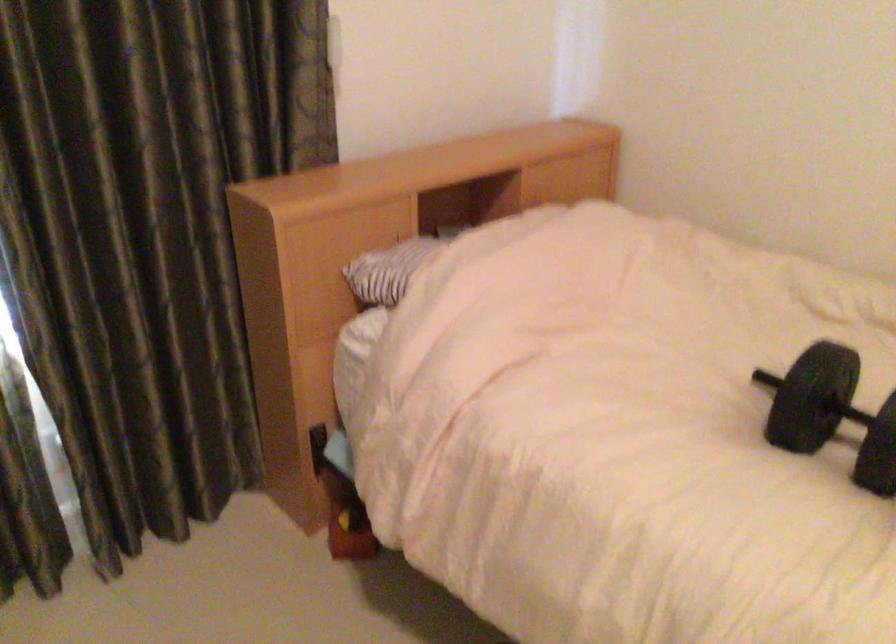
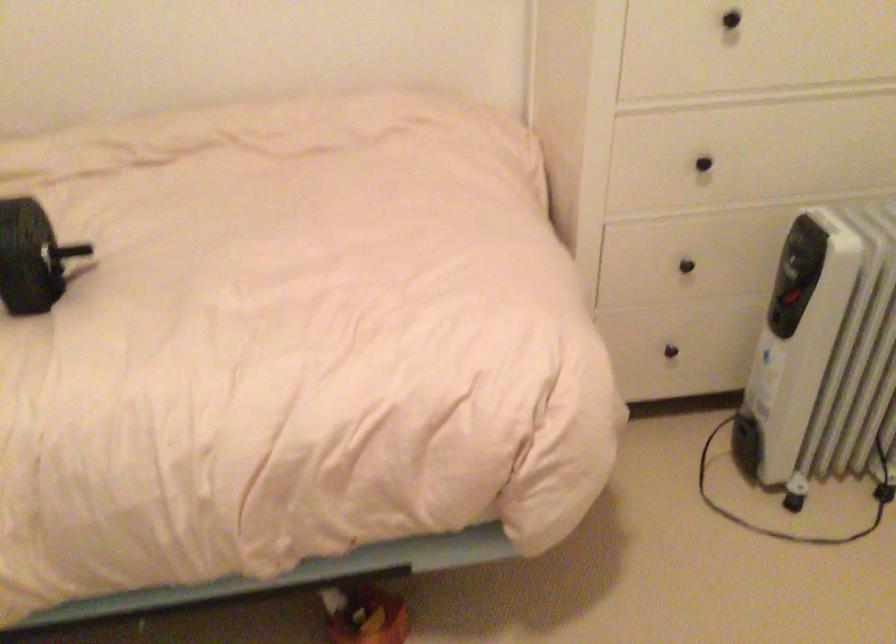
Looking at this image, how did the camera likely rotate?

The camera's rotation is toward right-down.